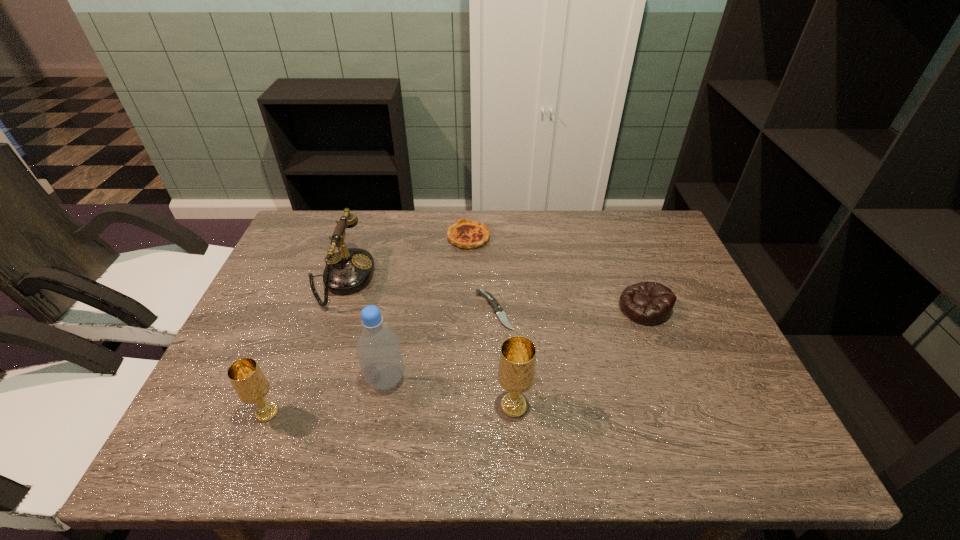
Locate an element on the screen. This screenshot has width=960, height=540. free spot that satisfies the following two spatial constraints: 1. on the dial of the third object from left to right; 2. on the right side of the telephone is located at coordinates (305, 379).

You are a GUI agent. You are given a task and a screenshot of the screen. Output one action in this format:
    pyautogui.click(x=<x>, y=<y>)
    Task: Click on the free space that satisfies the following two spatial constraints: 1. on the dial of the telephone; 2. on the back side of the taller chalice
    Image resolution: width=960 pixels, height=540 pixels.
    Given the screenshot: What is the action you would take?
    pyautogui.click(x=296, y=406)

Image resolution: width=960 pixels, height=540 pixels. What are the coordinates of `vacant position in the image that satisfies the following two spatial constraints: 1. on the dial of the telephone; 2. on the back side of the third shortest object` in the screenshot? It's located at (330, 308).

Find the location of a particular element. free location that satisfies the following two spatial constraints: 1. on the front side of the pocketknife; 2. on the right side of the taller chalice is located at coordinates coord(497,406).

The width and height of the screenshot is (960, 540). Identify the location of free spot that satisfies the following two spatial constraints: 1. on the dial of the telephone; 2. on the right side of the rightmost object. (330, 308).